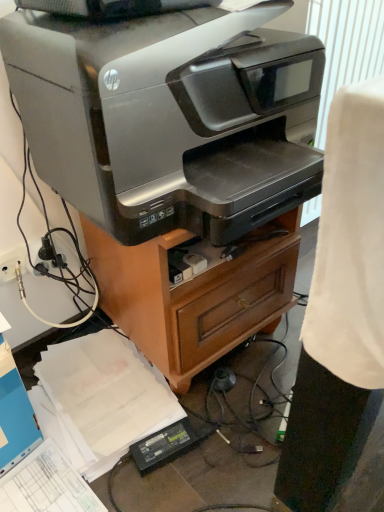
Question: From a real-world perspective, is black plastic plug at lower left on top of satin silver printer at center?

Choices:
 (A) no
 (B) yes

Answer: (A)

Question: Is black plastic plug at lower left next to satin silver printer at center and touching it?

Choices:
 (A) yes
 (B) no

Answer: (B)

Question: Considering the relative positions of black plastic plug at lower left and satin silver printer at center in the image provided, is black plastic plug at lower left to the right of satin silver printer at center from the viewer's perspective?

Choices:
 (A) no
 (B) yes

Answer: (A)

Question: Is black plastic plug at lower left not near satin silver printer at center?

Choices:
 (A) yes
 (B) no

Answer: (B)

Question: From a real-world perspective, is black plastic plug at lower left positioned under satin silver printer at center based on gravity?

Choices:
 (A) no
 (B) yes

Answer: (B)

Question: Would you say black plastic plug at lower left is to the left or to the right of silver metallic printer at center in the picture?

Choices:
 (A) right
 (B) left

Answer: (B)

Question: Is point (46, 237) closer or farther from the camera than point (117, 305)?

Choices:
 (A) closer
 (B) farther

Answer: (A)

Question: Is black plastic plug at lower left in front of or behind silver metallic printer at center in the image?

Choices:
 (A) front
 (B) behind

Answer: (B)

Question: Is black plastic plug at lower left taller or shorter than silver metallic printer at center?

Choices:
 (A) tall
 (B) short

Answer: (B)

Question: Looking at their shapes, would you say satin silver printer at center is wider or thinner than black plastic plug at lower left?

Choices:
 (A) wide
 (B) thin

Answer: (A)

Question: Visually, is satin silver printer at center positioned to the left or to the right of black plastic plug at lower left?

Choices:
 (A) right
 (B) left

Answer: (A)

Question: Considering their positions, is satin silver printer at center located in front of or behind black plastic plug at lower left?

Choices:
 (A) behind
 (B) front

Answer: (B)

Question: Is satin silver printer at center bigger or smaller than black plastic plug at lower left?

Choices:
 (A) small
 (B) big

Answer: (B)

Question: Is satin silver printer at center bigger or smaller than silver metallic printer at center?

Choices:
 (A) big
 (B) small

Answer: (B)

Question: Is satin silver printer at center spatially inside silver metallic printer at center, or outside of it?

Choices:
 (A) outside
 (B) inside

Answer: (A)